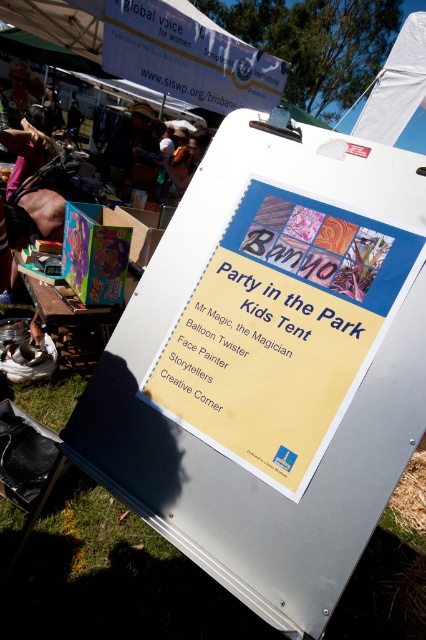
Between point (267, 292) and point (276, 92), which one is positioned in front?

Point (267, 292)

Is point (333, 339) in front of point (255, 74)?

Yes, point (333, 339) is closer to viewer.

Who is more distant from viewer, (307, 321) or (180, 74)?

The point (180, 74) is more distant.

Where is `yellow paper sign at center`? yellow paper sign at center is located at coordinates (282, 330).